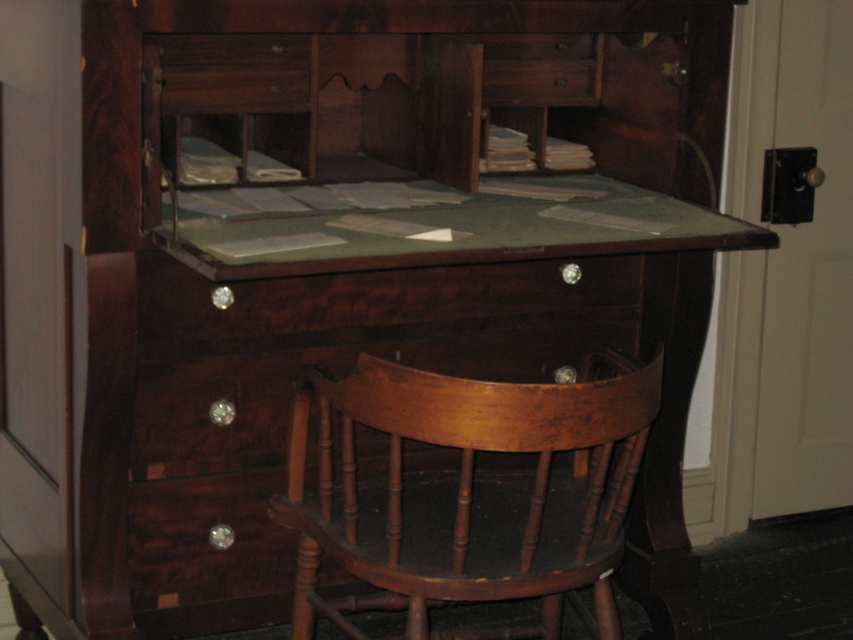
You are organizing a historical exhibit and need to place a 10 cm tall artifact on either the light brown wood chair at center or the shiny dark wood drawer at center. Which surface can safely support the artifact without it falling off?

A: The shiny dark wood drawer at center is above the light brown wood chair at center, so placing the artifact on the shiny dark wood drawer at center would be higher and safer to prevent it from falling off.

You are organizing a historical exhibit and need to place a sign between the light brown wood chair at center and the shiny dark wood drawer at center. Where should you place the sign so it is between them?

The sign should be placed between the light brown wood chair at center and the shiny dark wood drawer at center on the right side of the shiny dark wood drawer at center since the light brown wood chair at center is positioned on the right side of it.

You are standing in front of the vintage wooden desk and want to reach the point at coordinates (345, 552). If your arm can extend 3 feet, can you reach that point without moving?

The distance between you and the point at coordinates (345, 552) is 5.33 feet. Since your arm can only extend 3 feet, you cannot reach it without moving.